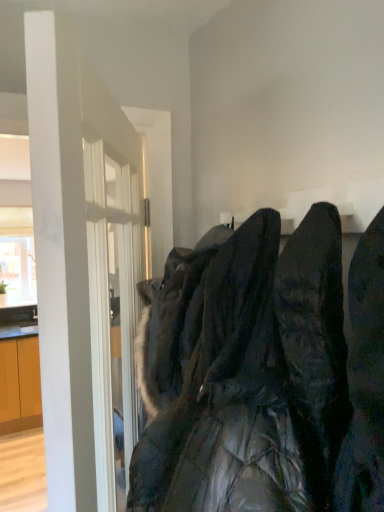
This screenshot has height=512, width=384. What do you see at coordinates (244, 371) in the screenshot?
I see `black quilted jacket at center` at bounding box center [244, 371].

You are a GUI agent. You are given a task and a screenshot of the screen. Output one action in this format:
    pyautogui.click(x=<x>, y=<y>)
    Task: Click on the black quilted jacket at center
    The height and width of the screenshot is (512, 384).
    Given the screenshot: What is the action you would take?
    pyautogui.click(x=244, y=371)

Measure the distance between point (223,325) and camera.

Point (223,325) and camera are 30.39 inches apart from each other.

Identify the location of white glossy door at left. (81, 262).

What do you see at coordinates (81, 262) in the screenshot?
I see `white glossy door at left` at bounding box center [81, 262].

Where is `black quilted jacket at center`? The width and height of the screenshot is (384, 512). black quilted jacket at center is located at coordinates (244, 371).

Is black quilted jacket at center at the right side of white glossy door at left?

Yes.

Is black quilted jacket at center positioned behind white glossy door at left?

No.

Considering the positions of point (265, 502) and point (42, 233), is point (265, 502) closer or farther from the camera than point (42, 233)?

Point (265, 502).

From the image's perspective, is black quilted jacket at center on top of white glossy door at left?

Indeed, from the image's perspective, black quilted jacket at center is shown above white glossy door at left.

From a real-world perspective, which object rests below the other?

white glossy door at left is physically lower.

Based on the photo, in terms of width, does black quilted jacket at center look wider or thinner when compared to white glossy door at left?

In the image, black quilted jacket at center appears to be wider than white glossy door at left.

Between black quilted jacket at center and white glossy door at left, which one has more height?

With more height is white glossy door at left.

Does black quilted jacket at center have a larger size compared to white glossy door at left?

No.

Is black quilted jacket at center spatially inside white glossy door at left, or outside of it?

black quilted jacket at center is not enclosed by white glossy door at left.

Is there a large distance between black quilted jacket at center and white glossy door at left?

They are positioned close to each other.

Is black quilted jacket at center facing towards white glossy door at left?

Yes, black quilted jacket at center is turned towards white glossy door at left.

Can you tell me how much black quilted jacket at center and white glossy door at left differ in facing direction?

black quilted jacket at center and white glossy door at left are facing 31.6 degrees away from each other.

Image resolution: width=384 pixels, height=512 pixels. I want to click on door that is under the black quilted jacket at center (from a real-world perspective), so 81,262.

Considering the relative positions of white glossy door at left and black quilted jacket at center in the image provided, is white glossy door at left to the left of black quilted jacket at center from the viewer's perspective?

Yes, white glossy door at left is to the left of black quilted jacket at center.

Is white glossy door at left positioned in front of black quilted jacket at center?

No, the depth of white glossy door at left is greater than that of black quilted jacket at center.

Is point (104, 404) more distant than point (152, 498)?

No, it is in front of (152, 498).

From the image's perspective, is white glossy door at left under black quilted jacket at center?

Yes, from the image's perspective, white glossy door at left is below black quilted jacket at center.

From a real-world perspective, which is physically below, white glossy door at left or black quilted jacket at center?

white glossy door at left, from a real-world perspective.

Between white glossy door at left and black quilted jacket at center, which one has larger width?

black quilted jacket at center is wider.

In the scene shown: Can you confirm if white glossy door at left is shorter than black quilted jacket at center?

No, white glossy door at left is not shorter than black quilted jacket at center.

Considering the relative sizes of white glossy door at left and black quilted jacket at center in the image provided, is white glossy door at left bigger than black quilted jacket at center?

Correct, white glossy door at left is larger in size than black quilted jacket at center.

Would you say white glossy door at left is inside or outside black quilted jacket at center?

white glossy door at left is located beyond the bounds of black quilted jacket at center.

Would you say white glossy door at left is a long distance from black quilted jacket at center?

That's not correct — white glossy door at left is a little close to black quilted jacket at center.

Is white glossy door at left oriented towards black quilted jacket at center?

Yes, white glossy door at left is aimed at black quilted jacket at center.

How many degrees apart are the facing directions of white glossy door at left and black quilted jacket at center?

The angle between the facing direction of white glossy door at left and the facing direction of black quilted jacket at center is 31.6 degrees.

At what (x,y) coordinates should I click in order to perform the action: click on laundry located in front of the white glossy door at left. Please return your answer as a coordinate pair (x, y). The image size is (384, 512). Looking at the image, I should click on (244, 371).

The image size is (384, 512). Find the location of `laundry lying on the right of white glossy door at left`. laundry lying on the right of white glossy door at left is located at coordinates (244, 371).

Find the location of `door behind the black quilted jacket at center`. door behind the black quilted jacket at center is located at coordinates (81, 262).